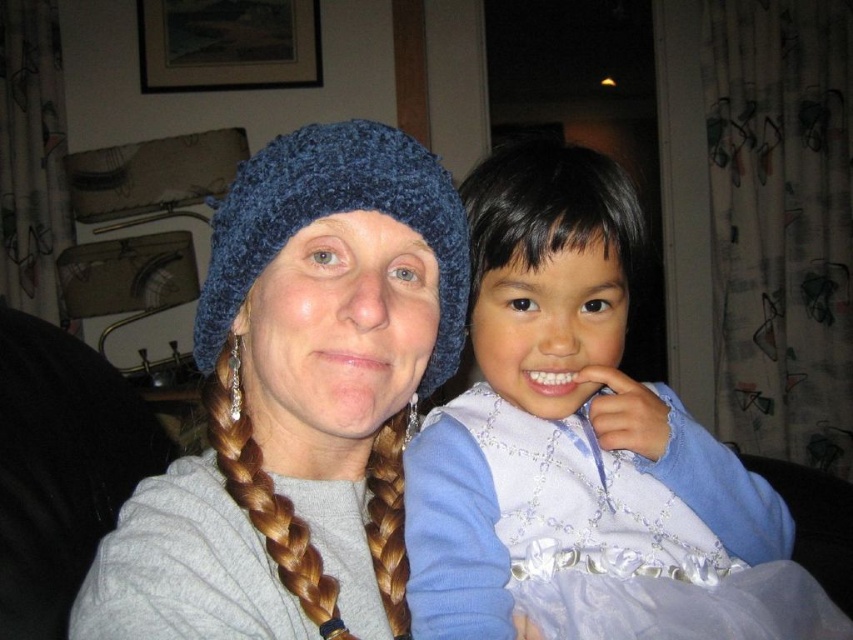
You are an interior designer assessing the placement of accessories in this room. You notice the blue knitted hat at upper left and the brown braided hair at left. Which accessory is positioned higher on the wall?

The blue knitted hat at upper left is located above the brown braided hair at left, so it is positioned higher on the wall.

You are a photographer setting up a shot of the adult and child sitting together. The blue knitted hat at upper left is an important element for the composition. Considering the distance between them, will the hat be in frame if you position the camera 12 inches away from the adult?

The adult and child are 16.68 inches apart. Positioning the camera 12 inches away from the adult would mean the camera is closer than their separation distance. This might cause the hat to appear out of frame or distorted because the camera is too close to capture both subjects and the hat simultaneously.

You are standing in front of the image and notice two points marked on the scene. The first point is at coordinates point (781, 554) and the second is at point (738, 528). Which of these points is closer to you?

Point (781, 554) is further to the viewer than point (738, 528), so the point closer to you is point (738, 528).